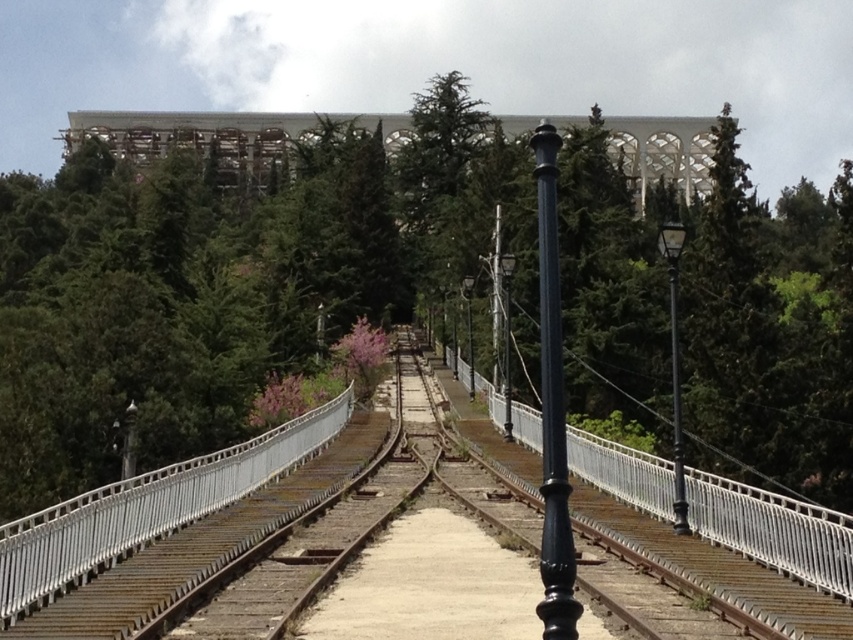
Is black metal rail at center below black polished metal pole at center?

Yes, black metal rail at center is below black polished metal pole at center.

Between black metal rail at center and black polished metal pole at center, which one appears on the right side from the viewer's perspective?

Positioned to the right is black polished metal pole at center.

The image size is (853, 640). Find the location of `black metal rail at center`. black metal rail at center is located at coordinates (711, 566).

Is green leafy tree at center bigger than black metal pole at center?

Correct, green leafy tree at center is larger in size than black metal pole at center.

Between point (405, 166) and point (679, 529), which one is positioned behind?

Point (405, 166)

Which is behind, point (167, 408) or point (672, 422)?

Point (672, 422)

Find the location of a particular element. green leafy tree at center is located at coordinates (235, 278).

Does white concrete bridge at upper center lie behind black polished metal pole at center?

Yes, it is behind black polished metal pole at center.

Between point (257, 125) and point (543, 177), which one is positioned in front?

Point (543, 177)

The image size is (853, 640). I want to click on white concrete bridge at upper center, so pyautogui.click(x=219, y=134).